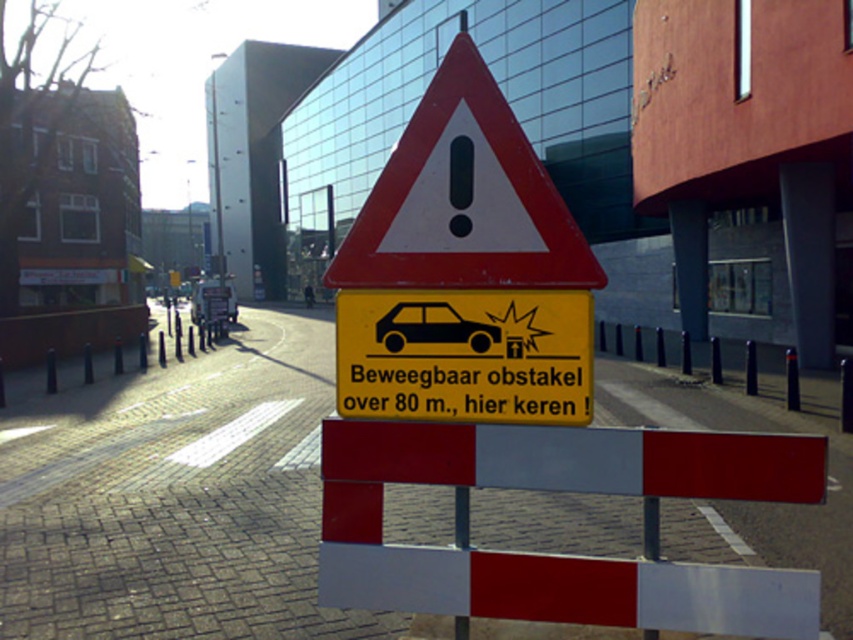
What do you see at coordinates (744, 378) in the screenshot? I see `red plastic barrier at center` at bounding box center [744, 378].

Who is shorter, red plastic barrier at center or black glossy car at center?

Standing shorter between the two is black glossy car at center.

Measure the distance between point (804, 424) and camera.

They are 11.09 meters apart.

Locate an element on the screen. The height and width of the screenshot is (640, 853). red plastic barrier at center is located at coordinates (744, 378).

Is the position of reflective plastic barrier at center more distant than that of yellow paper sign at center?

No, it is in front of yellow paper sign at center.

Can you confirm if reflective plastic barrier at center is thinner than yellow paper sign at center?

Incorrect, reflective plastic barrier at center's width is not less than yellow paper sign at center's.

Does point (343, 474) lie in front of point (392, 397)?

That is False.

The image size is (853, 640). In order to click on reflective plastic barrier at center in this screenshot , I will do `click(561, 556)`.

Is yellow paper sign at center taller than black glossy car at center?

Indeed, yellow paper sign at center has a greater height compared to black glossy car at center.

You are a GUI agent. You are given a task and a screenshot of the screen. Output one action in this format:
    pyautogui.click(x=<x>, y=<y>)
    Task: Click on the yellow paper sign at center
    The height and width of the screenshot is (640, 853).
    Given the screenshot: What is the action you would take?
    pyautogui.click(x=465, y=355)

Is point (451, 305) closer to camera compared to point (480, 332)?

Yes, point (451, 305) is closer to viewer.

At what (x,y) coordinates should I click in order to perform the action: click on yellow paper sign at center. Please return your answer as a coordinate pair (x, y). Looking at the image, I should click on point(465,355).